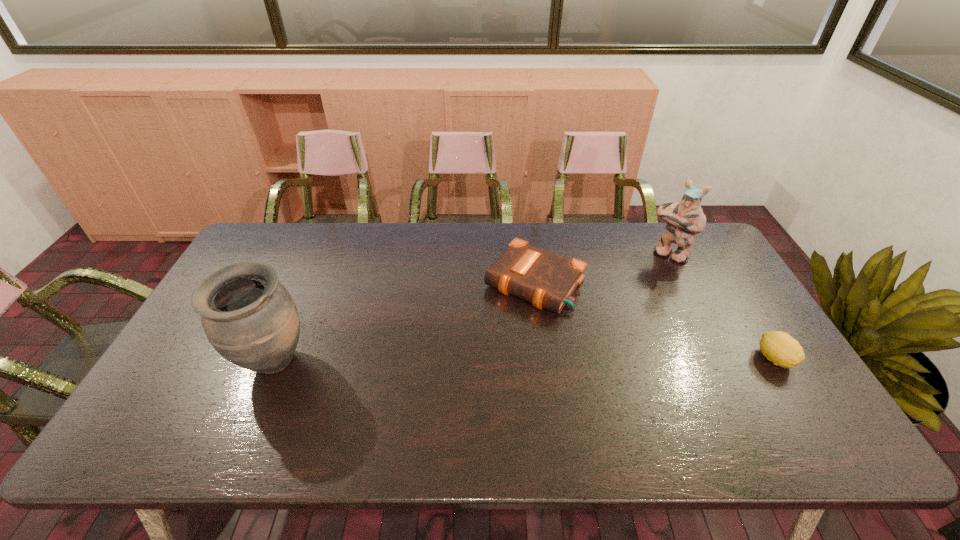
In the image, there is a desktop. Where is `free space at the left edge`? This screenshot has height=540, width=960. free space at the left edge is located at coordinates (180, 348).

In the image, there is a desktop. In order to click on vacant space at the right edge in this screenshot , I will do `click(748, 328)`.

In the image, there is a desktop. In order to click on free space at the far left corner in this screenshot , I will do `click(252, 243)`.

You are a GUI agent. You are given a task and a screenshot of the screen. Output one action in this format:
    pyautogui.click(x=<x>, y=<y>)
    Task: Click on the vacant area at the near left corner
    This screenshot has height=540, width=960.
    Given the screenshot: What is the action you would take?
    pyautogui.click(x=200, y=394)

At what (x,y) coordinates should I click in order to perform the action: click on vacant area at the near right corner. Please return your answer as a coordinate pair (x, y). Looking at the image, I should click on (791, 413).

The height and width of the screenshot is (540, 960). Find the location of `vacant area that lies between the leftmost object and the lemon`. vacant area that lies between the leftmost object and the lemon is located at coordinates (524, 361).

This screenshot has width=960, height=540. Find the location of `unoccupied position between the lemon and the urn`. unoccupied position between the lemon and the urn is located at coordinates (524, 361).

Locate an element on the screen. free area in between the second object from right to left and the urn is located at coordinates (471, 308).

You are a GUI agent. You are given a task and a screenshot of the screen. Output one action in this format:
    pyautogui.click(x=<x>, y=<y>)
    Task: Click on the vacant area that lies between the Bible and the rightmost object
    The image size is (960, 540).
    Given the screenshot: What is the action you would take?
    pyautogui.click(x=655, y=321)

The height and width of the screenshot is (540, 960). I want to click on vacant area between the lemon and the figurine, so click(722, 306).